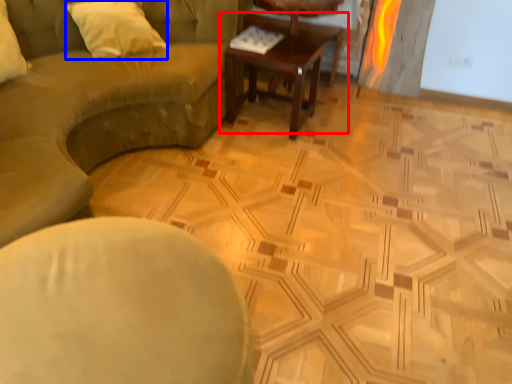
Question: Which point is closer to the camera, coffee table (highlighted by a red box) or pillow (highlighted by a blue box)?

Choices:
 (A) coffee table
 (B) pillow

Answer: (B)